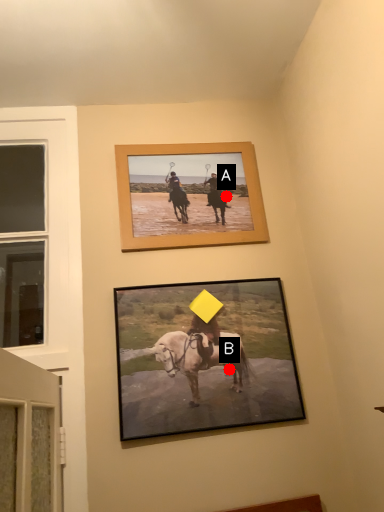
Question: Two points are circled on the image, labeled by A and B beside each circle. Which of the following is the closest to the observer?

Choices:
 (A) A is closer
 (B) B is closer

Answer: (B)